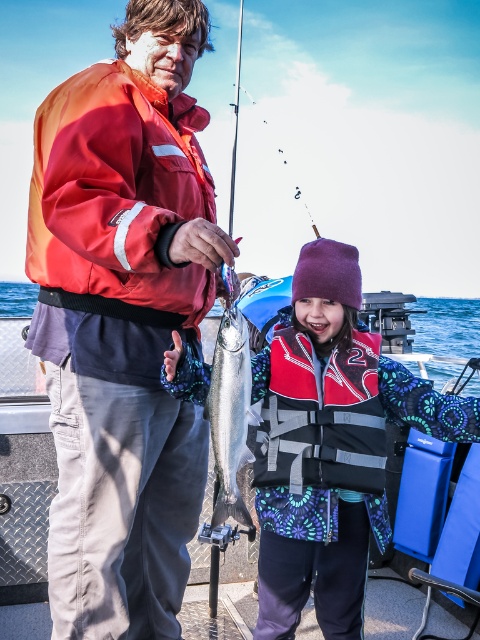
Please provide the 2D coordinates of the metallic blue boat at center in the image.

The metallic blue boat at center is located at coordinates 0.802 in the x axis and 0.054 in the y axis.

You are on a boat and see a point at coordinates (122, 321). What object is located there?

The point at coordinates (122, 321) indicates the matte red jacket at center.

You are on a boat and need to decide which item is larger between the matte red jacket at center and the shiny silver fish at center. Based on the scene, which one is bigger?

The matte red jacket at center is bigger than the shiny silver fish at center.